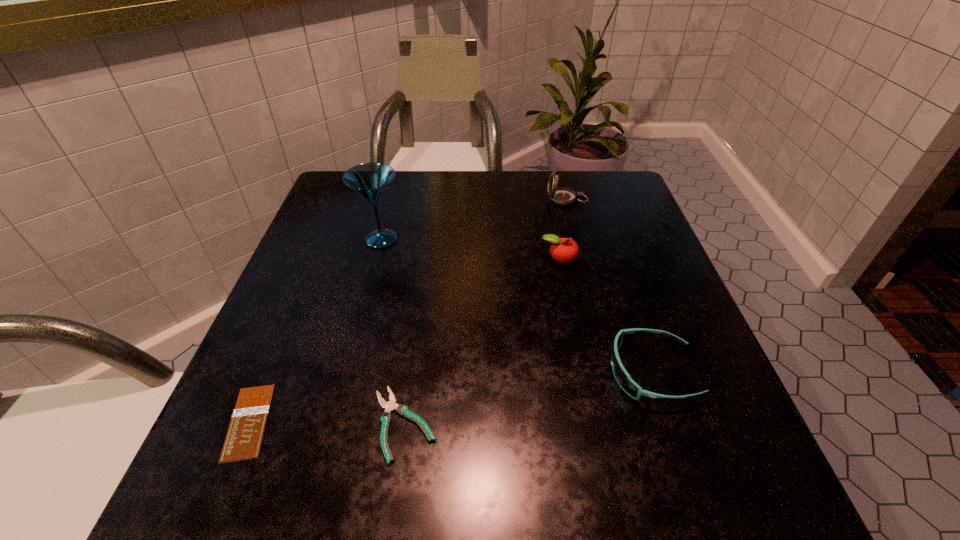
The image size is (960, 540). I want to click on free space that is in between the sunglasses and the fifth tallest object, so click(528, 398).

The width and height of the screenshot is (960, 540). I want to click on free spot between the fifth shortest object and the apple, so click(564, 229).

This screenshot has width=960, height=540. Find the location of `free spot between the martini and the fifth tallest object`. free spot between the martini and the fifth tallest object is located at coordinates (393, 332).

Locate an element on the screen. free area in between the second tallest object and the sunglasses is located at coordinates (610, 286).

Find the location of a particular element. Image resolution: width=960 pixels, height=540 pixels. unoccupied position between the leftmost object and the pliers is located at coordinates (326, 423).

I want to click on vacant space in between the fourth object from right to left and the sunglasses, so click(x=528, y=398).

You are a GUI agent. You are given a task and a screenshot of the screen. Output one action in this format:
    pyautogui.click(x=<x>, y=<y>)
    Task: Click on the second closest object relative to the sunglasses
    
    Given the screenshot: What is the action you would take?
    pyautogui.click(x=386, y=418)

Identify which object is the nearest to the tallest object. Please provide its 2D coordinates. Your answer should be formatted as a tuple, i.e. [(x, y)], where the tuple contains the x and y coordinates of a point satisfying the conditions above.

[(563, 250)]

This screenshot has width=960, height=540. I want to click on free space that satisfies the following two spatial constraints: 1. on the face of the compass; 2. on the front side of the apple, so click(x=583, y=258).